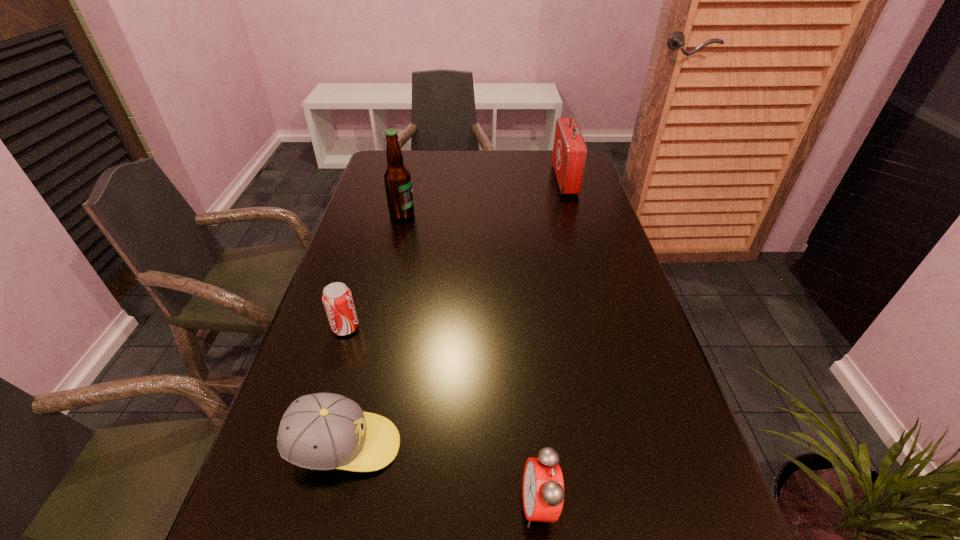
Identify the location of beer bottle. This screenshot has width=960, height=540. (397, 179).

Locate an element on the screen. The width and height of the screenshot is (960, 540). the tallest object is located at coordinates (397, 179).

I want to click on the rightmost object, so click(569, 155).

You are a GUI agent. You are given a task and a screenshot of the screen. Output one action in this format:
    pyautogui.click(x=<x>, y=<y>)
    Task: Click on the first-aid kit
    The height and width of the screenshot is (540, 960).
    Given the screenshot: What is the action you would take?
    pyautogui.click(x=569, y=155)

The height and width of the screenshot is (540, 960). Find the location of `soda can`. soda can is located at coordinates (337, 299).

In order to click on the fourth object from left to right in this screenshot , I will do `click(543, 486)`.

I want to click on baseball cap, so click(323, 431).

You are a GUI agent. You are given a task and a screenshot of the screen. Output one action in this format:
    pyautogui.click(x=<x>, y=<y>)
    Task: Click on the vacant area situated on the label of the beer bottle
    The image size is (960, 540).
    Given the screenshot: What is the action you would take?
    pyautogui.click(x=459, y=214)

At what (x,y) coordinates should I click in order to perform the action: click on free point located 0.360m on the side of the farthest object with the first aid cross symbol. Please return your answer as a coordinate pair (x, y). Looking at the image, I should click on (454, 179).

In order to click on free spot located 0.170m on the side of the farthest object with the first aid cross symbol in this screenshot , I will do `click(508, 179)`.